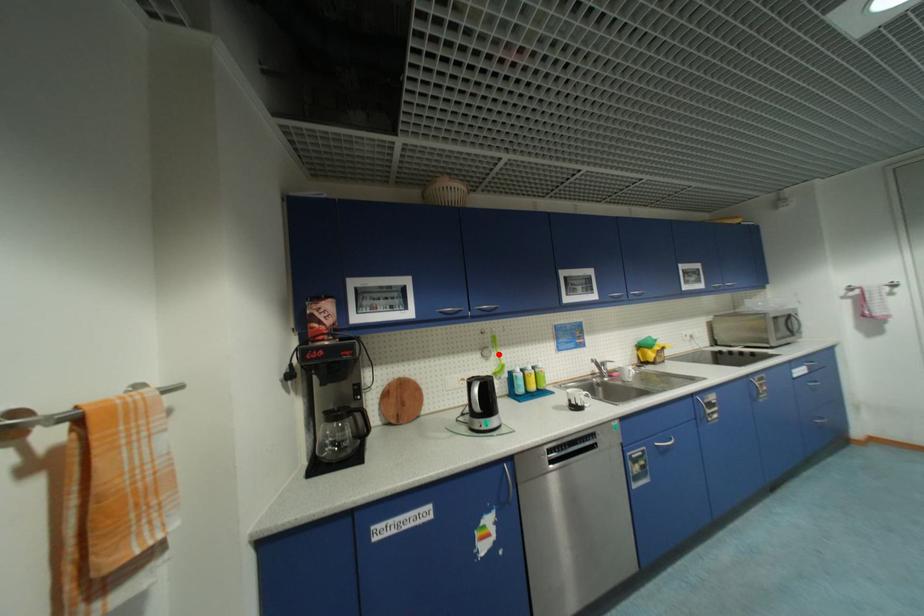
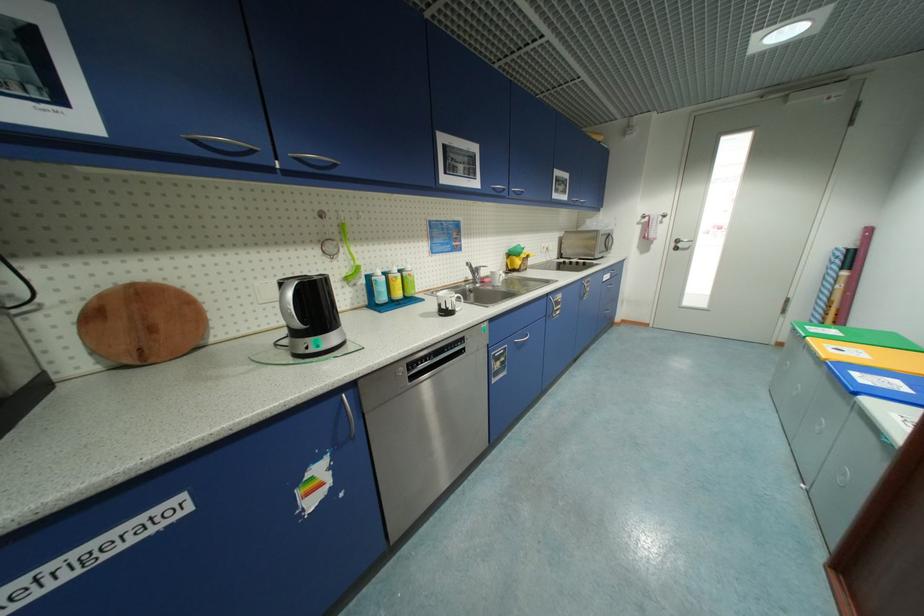
Find the pixel in the second image that matches the highlighted location in the first image.

(347, 251)